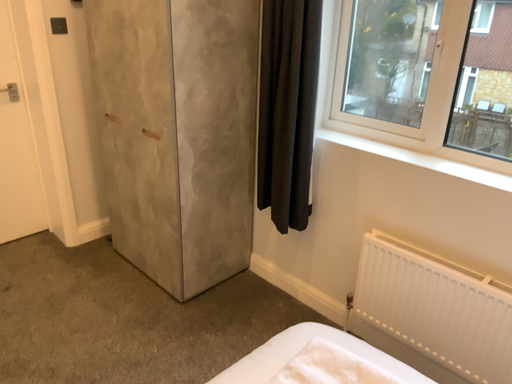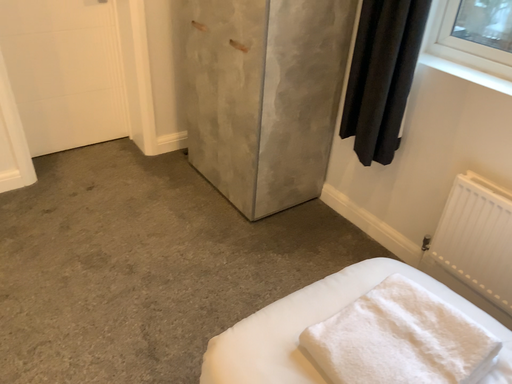
Question: Which way did the camera rotate in the video?

Choices:
 (A) rotated upward
 (B) rotated downward

Answer: (B)